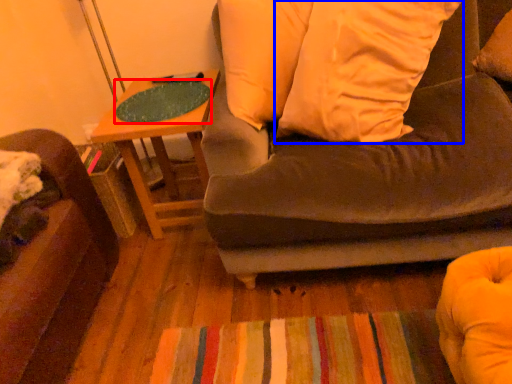
Question: Which object is further to the camera taking this photo, table top (highlighted by a red box) or pillow (highlighted by a blue box)?

Choices:
 (A) table top
 (B) pillow

Answer: (A)